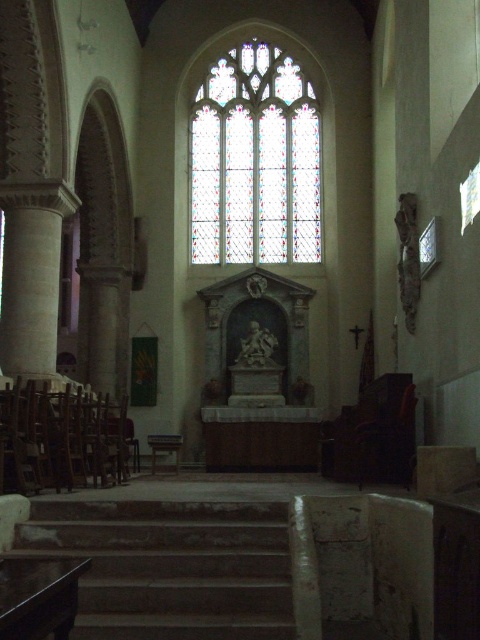
You are a visitor in the church and want to take a photo of the stone stairs at center and the wooden at left. Which one should you zoom in more on to capture their full height in the frame?

Since the stone stairs at center is shorter than wooden at left, you should zoom in more on the wooden at left to capture its full height in the frame.

You are an architect examining the church altar area. You notice the wooden at left and the white stone column at left. Which object is positioned lower in the scene?

The wooden at left is positioned lower than the white stone column at left.